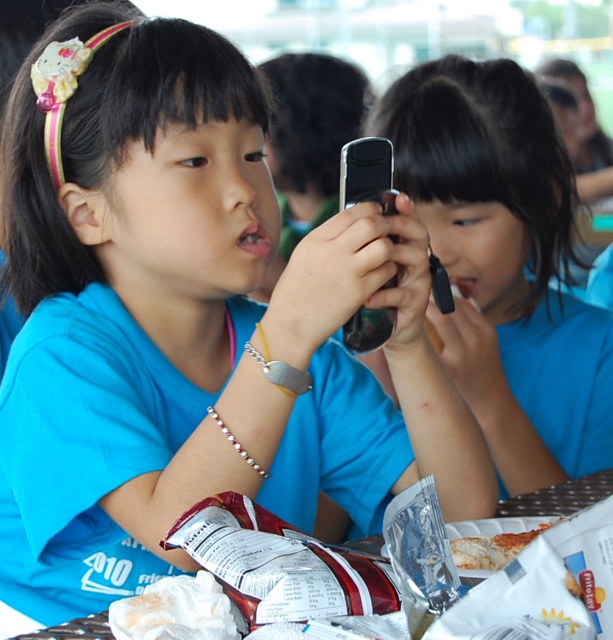
Is matte black phone at center shorter than white paper plate at lower center?

In fact, matte black phone at center may be taller than white paper plate at lower center.

Does matte black phone at center appear on the left side of white paper plate at lower center?

In fact, matte black phone at center is to the right of white paper plate at lower center.

Is point (438, 148) farther from viewer compared to point (481, 557)?

Yes, it is.

This screenshot has width=613, height=640. Identify the location of matte black phone at center. (504, 262).

Does matte black phone at center appear on the left side of silver metallic phone at center?

In fact, matte black phone at center is to the right of silver metallic phone at center.

Measure the distance from matte black phone at center to silver metallic phone at center.

The distance of matte black phone at center from silver metallic phone at center is 19.84 inches.

What do you see at coordinates (504, 262) in the screenshot? This screenshot has height=640, width=613. I see `matte black phone at center` at bounding box center [504, 262].

I want to click on matte black phone at center, so click(x=504, y=262).

Does silver metallic phone at center have a larger size compared to white paper plate at lower center?

Yes.

Can you confirm if silver metallic phone at center is thinner than white paper plate at lower center?

Correct, silver metallic phone at center's width is less than white paper plate at lower center's.

Identify the location of silver metallic phone at center. This screenshot has height=640, width=613. (367, 173).